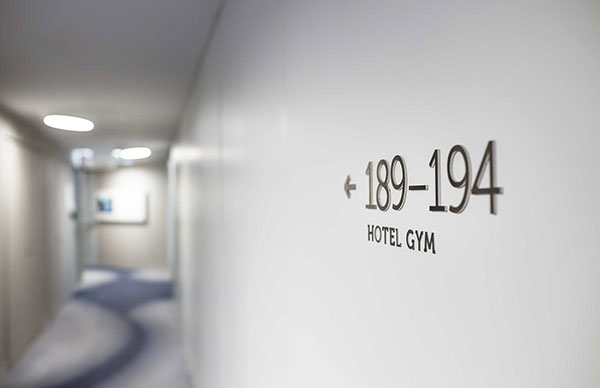
Find the location of a particular element. white wall is located at coordinates (276, 256).